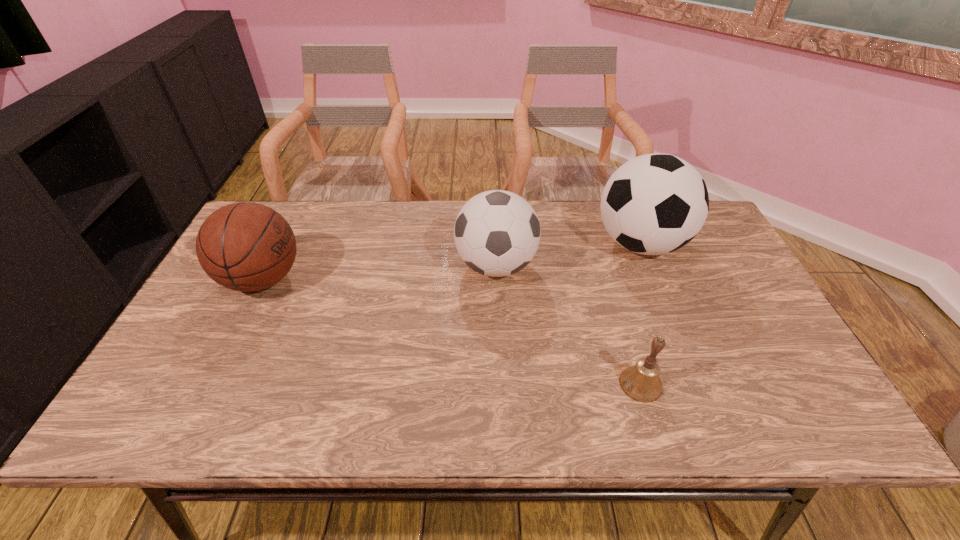
Image resolution: width=960 pixels, height=540 pixels. Identify the location of free space between the leftmost object and the shorter soccer ball. [379, 272].

The width and height of the screenshot is (960, 540). I want to click on vacant area that lies between the shortest object and the right soccer ball, so click(640, 314).

Where is `free space between the nearest object and the leftmost object`? free space between the nearest object and the leftmost object is located at coordinates (452, 332).

I want to click on free space that is in between the tallest object and the nearest object, so click(640, 314).

Identify the location of empty space that is in between the nearest object and the right soccer ball. The height and width of the screenshot is (540, 960). (640, 314).

This screenshot has height=540, width=960. I want to click on empty space between the taller soccer ball and the nearest object, so click(x=640, y=314).

Find the location of a particular element. This screenshot has height=540, width=960. vacant area between the tallest object and the second object from left to right is located at coordinates (568, 255).

Locate an element on the screen. This screenshot has height=540, width=960. blank region between the bell and the shorter soccer ball is located at coordinates coord(568,325).

Identify the location of object that stands as the second closest to the shortest object. Image resolution: width=960 pixels, height=540 pixels. (654, 204).

I want to click on object that is the second nearest to the tallest object, so click(641, 382).